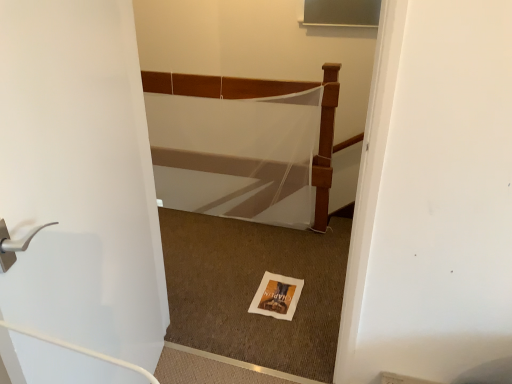
Question: Considering the relative positions of white matte door at left and white mesh bed at center in the image provided, is white matte door at left behind white mesh bed at center?

Choices:
 (A) no
 (B) yes

Answer: (A)

Question: Does white matte door at left have a lesser width compared to white mesh bed at center?

Choices:
 (A) yes
 (B) no

Answer: (A)

Question: Is white matte door at left at the left side of white mesh bed at center?

Choices:
 (A) yes
 (B) no

Answer: (A)

Question: Is white matte door at left wider than white mesh bed at center?

Choices:
 (A) yes
 (B) no

Answer: (B)

Question: From the image's perspective, does white matte door at left appear lower than white mesh bed at center?

Choices:
 (A) no
 (B) yes

Answer: (B)

Question: Is white paper postcard at center situated inside white mesh bed at center or outside?

Choices:
 (A) outside
 (B) inside

Answer: (A)

Question: Is point (x=289, y=296) closer or farther from the camera than point (x=315, y=175)?

Choices:
 (A) closer
 (B) farther

Answer: (A)

Question: Is white paper postcard at center bigger or smaller than white mesh bed at center?

Choices:
 (A) big
 (B) small

Answer: (B)

Question: In the image, is white paper postcard at center on the left side or the right side of white mesh bed at center?

Choices:
 (A) right
 (B) left

Answer: (A)

Question: Is white mesh bed at center to the left or to the right of white paper postcard at center in the image?

Choices:
 (A) left
 (B) right

Answer: (A)

Question: Looking at their shapes, would you say white mesh bed at center is wider or thinner than white paper postcard at center?

Choices:
 (A) wide
 (B) thin

Answer: (B)

Question: Is white mesh bed at center in front of or behind white paper postcard at center in the image?

Choices:
 (A) front
 (B) behind

Answer: (B)

Question: Considering the positions of point (243, 87) and point (291, 281), is point (243, 87) closer or farther from the camera than point (291, 281)?

Choices:
 (A) closer
 (B) farther

Answer: (B)

Question: From a real-world perspective, is white matte door at left positioned above or below white mesh bed at center?

Choices:
 (A) above
 (B) below

Answer: (A)

Question: Is point tap(129, 200) positioned closer to the camera than point tap(321, 167)?

Choices:
 (A) farther
 (B) closer

Answer: (B)